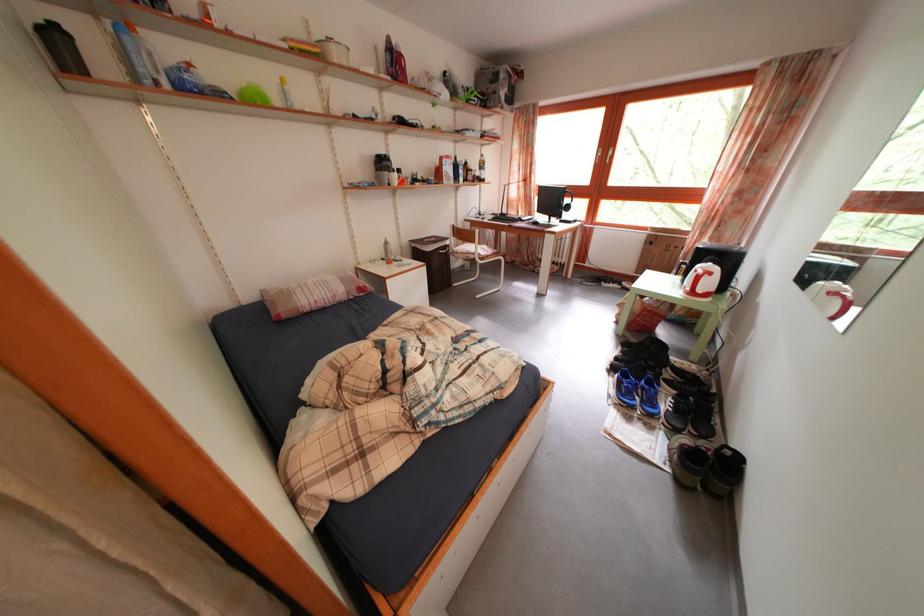
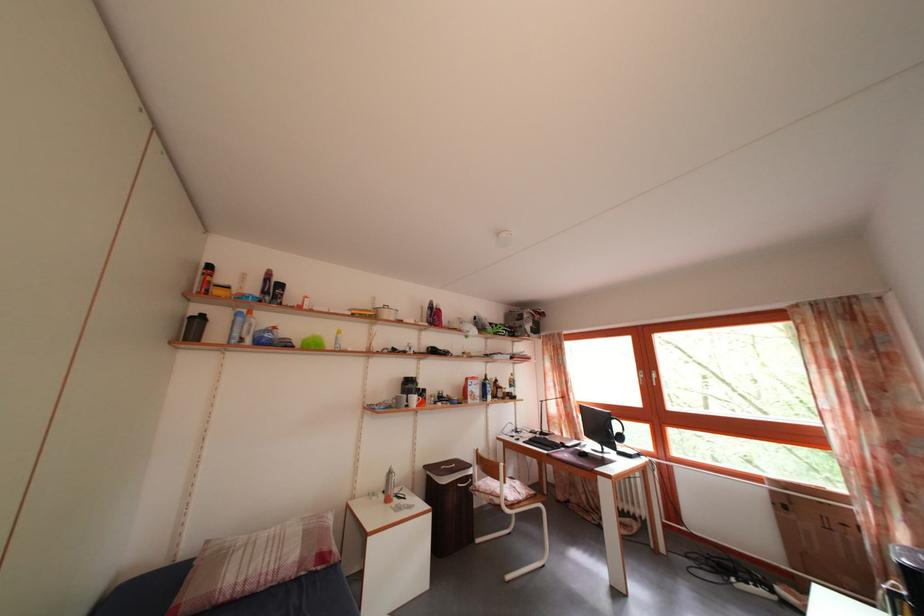
Where in the second image is the point corresponding to [575,207] from the first image?

(624, 434)